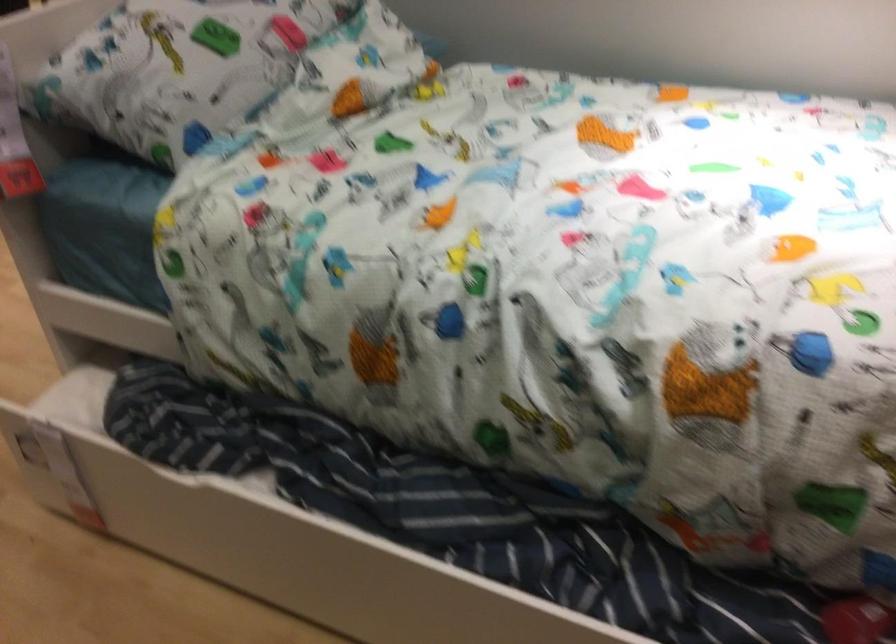
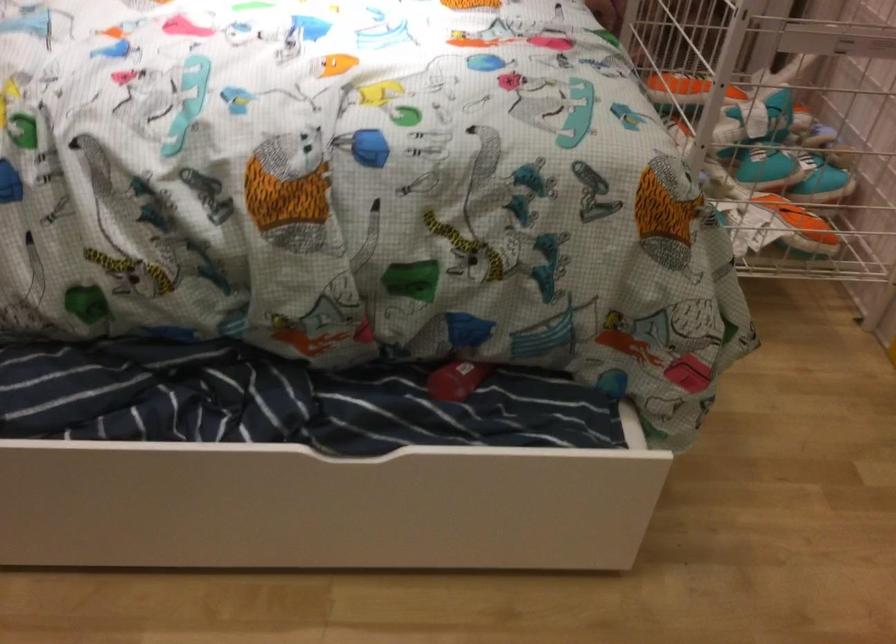
Question: The first image is from the beginning of the video and the second image is from the end. How did the camera likely rotate when shooting the video?

Choices:
 (A) Left
 (B) Right
 (C) Up
 (D) Down

Answer: (B)